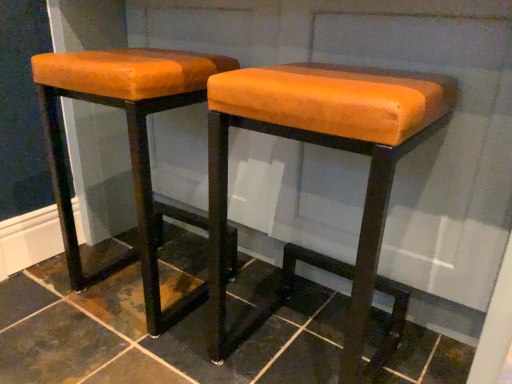
This screenshot has width=512, height=384. I want to click on free space to the left of orange leather stool at left, which is counted as the first stool, starting from the left, so tap(50, 289).